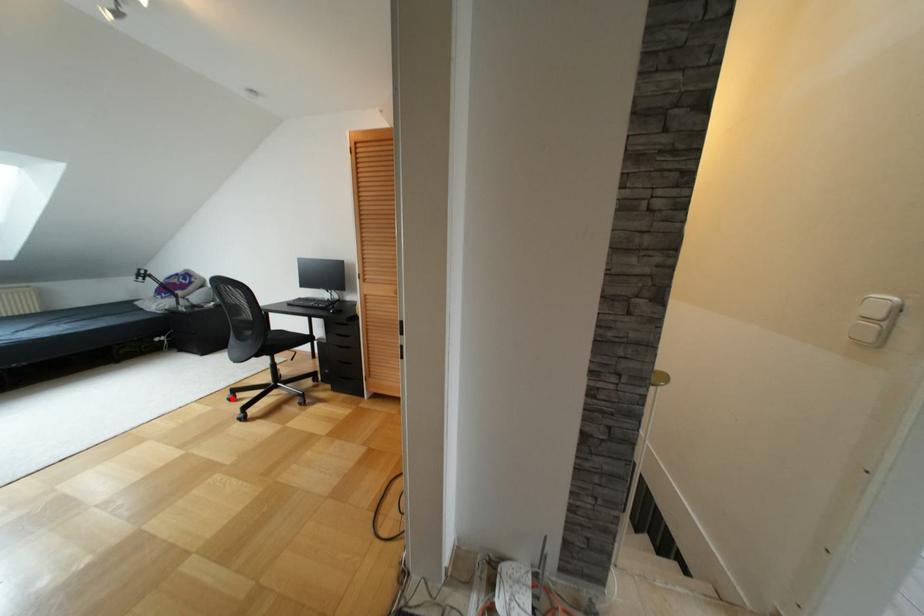
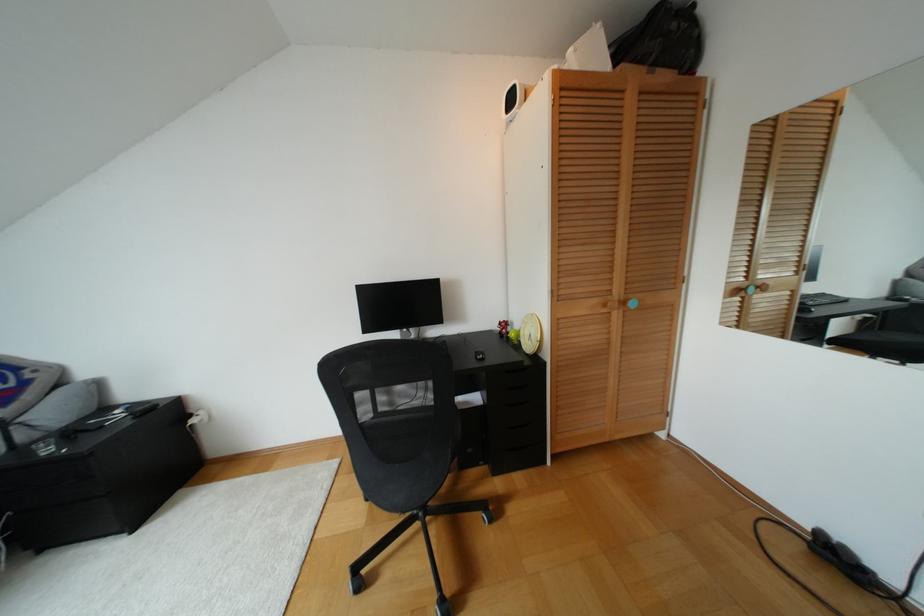
Question: I am providing you with two images of the same scene from different viewpoints. Given a red point in image1, look at the same physical point in image2. Is it:

Choices:
 (A) Closer to the viewpoint
 (B) Farther from the viewpoint

Answer: (A)